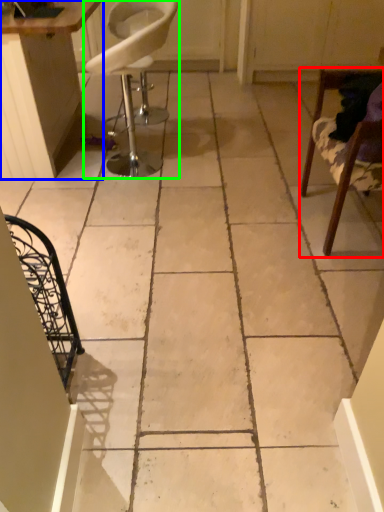
Question: Considering the real-world distances, which object is closest to chair (highlighted by a red box)? table (highlighted by a blue box) or chair (highlighted by a green box).

Choices:
 (A) table
 (B) chair

Answer: (A)